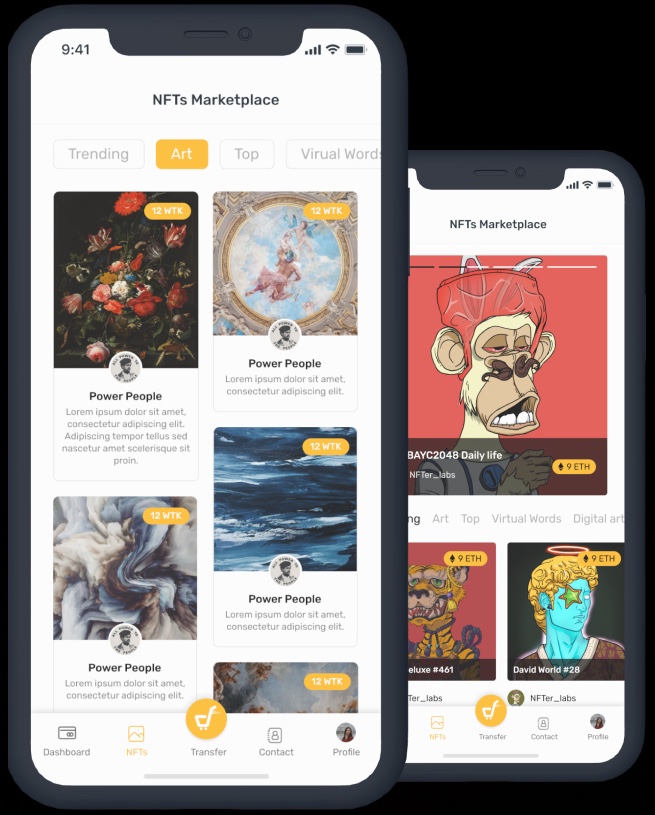
Where is `phone in the background`? The height and width of the screenshot is (815, 655). phone in the background is located at coordinates (571, 166).